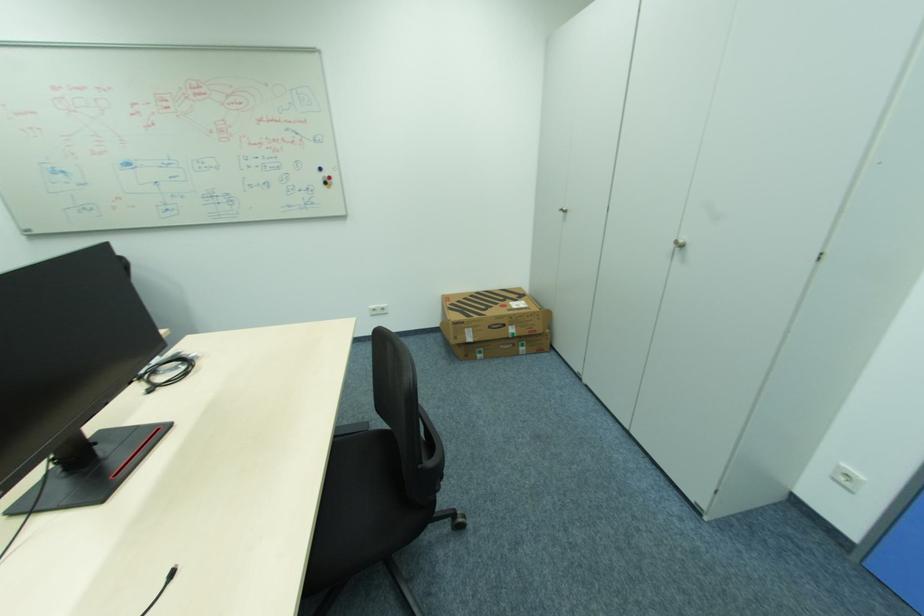
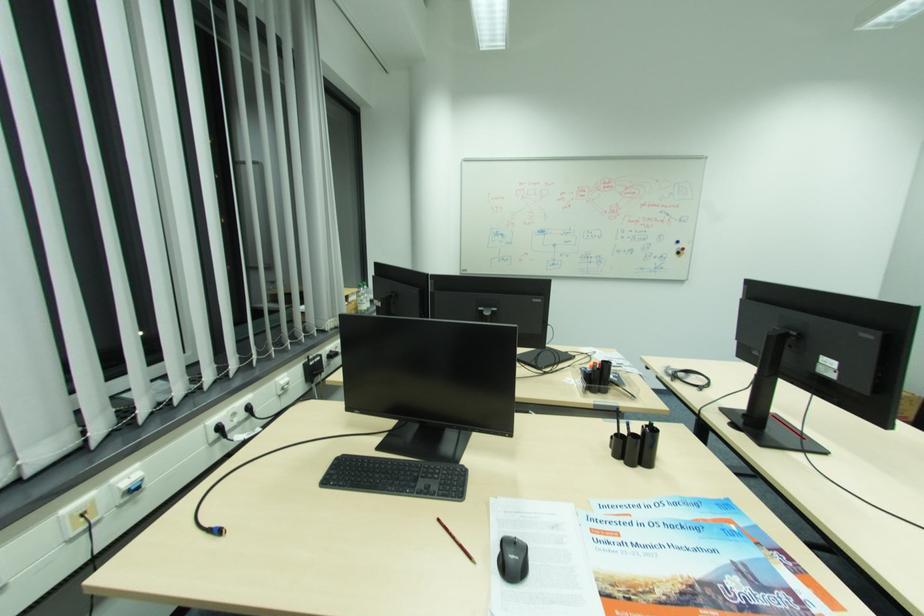
Locate, in the second image, the point that corresponds to the point at 331,184 in the first image.

(684, 253)